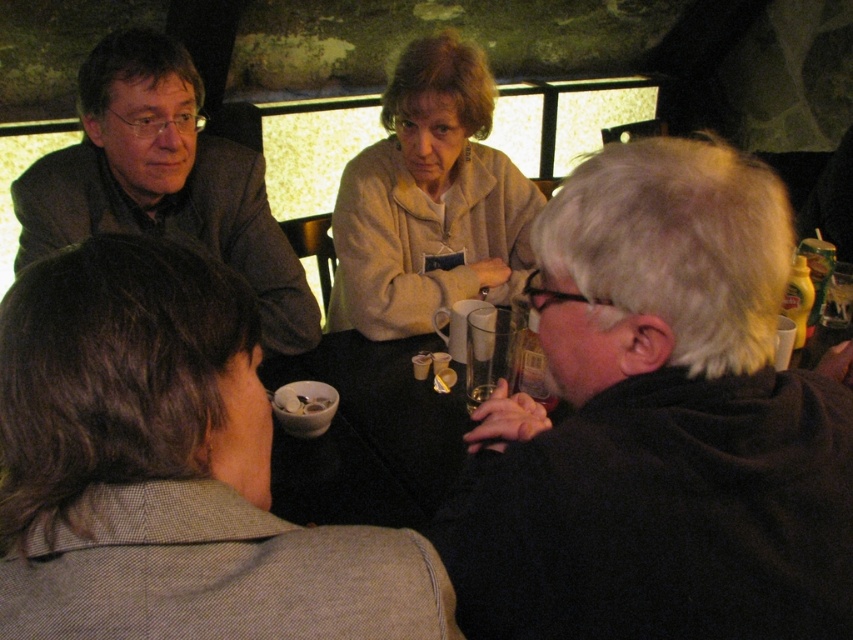
You are standing in a dimly lit indoor setting, possibly a cafe or restaurant. There is a point at coordinates point (80, 218). If you want to place a small table exactly 1.5 meters away from that point, where should you position it relative to the point?

The distance between point (80, 218) and the viewer is 1.52 meters. To place the table exactly 1.5 meters away from the point, position it slightly closer to the point than your current position.

You are a photographer trying to capture a candid shot of the matte brown jacket at upper left and the white matte bowl at center. Since the lighting is low, you need to adjust your camera settings. Considering their sizes, which object should you focus on first to ensure proper exposure?

The matte brown jacket at upper left is taller than the white matte bowl at center, so you should focus on the matte brown jacket at upper left first to ensure proper exposure due to its larger size in the frame.